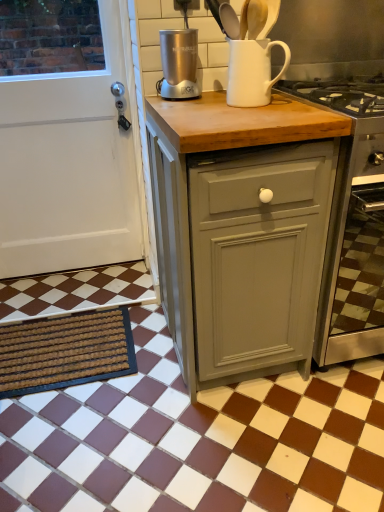
Identify the location of free point above matte gray cabinet at center (from a real-world perspective). This screenshot has width=384, height=512. (240, 108).